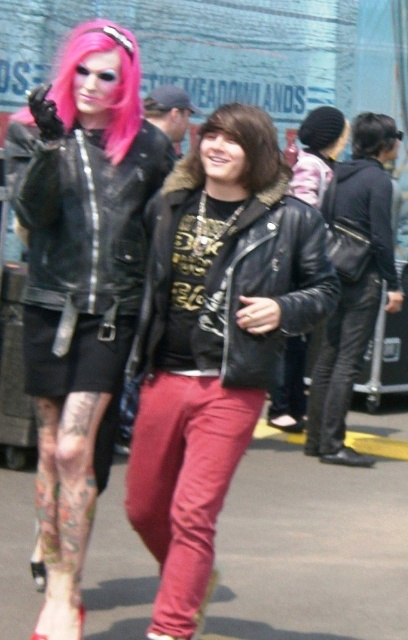
Does black leather jacket at right have a lesser width compared to pink synthetic wig at upper left?

No, black leather jacket at right is not thinner than pink synthetic wig at upper left.

Between black leather jacket at right and pink synthetic wig at upper left, which one has less height?

With less height is pink synthetic wig at upper left.

Is point (383, 152) farther from viewer compared to point (133, 44)?

Yes, it is.

Identify the location of black leather jacket at right. (354, 284).

Can you confirm if matte black leather jacket at left is smaller than black matte hair at upper right?

Actually, matte black leather jacket at left might be larger than black matte hair at upper right.

Does point (62, 140) lie in front of point (388, 120)?

Yes, point (62, 140) is closer to viewer.

At what (x,y) coordinates should I click in order to perform the action: click on matte black leather jacket at left. Please return your answer as a coordinate pair (x, y). Looking at the image, I should click on tap(81, 282).

Locate an element on the screen. This screenshot has height=640, width=408. matte black leather jacket at left is located at coordinates (81, 282).

Which of these two, leather jacket at center or pink synthetic wig at upper left, stands taller?

leather jacket at center is taller.

Does point (173, 220) lie in front of point (110, 38)?

No, it is behind (110, 38).

Is point (199, 483) positioned before point (71, 61)?

Yes, point (199, 483) is closer to viewer.

Where is `leather jacket at center`? This screenshot has height=640, width=408. leather jacket at center is located at coordinates (214, 340).